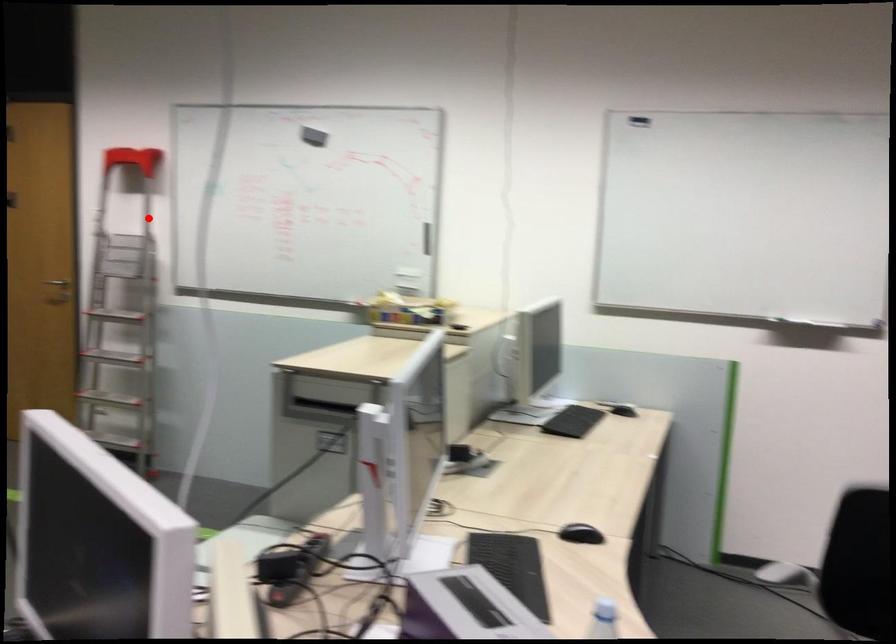
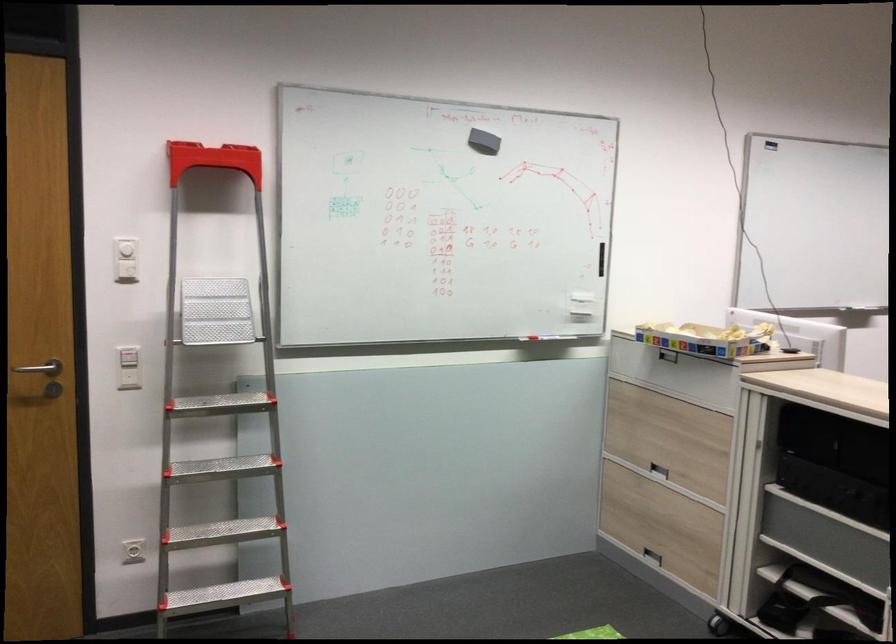
Question: I am providing you with two images of the same scene from different viewpoints. A red point is marked on the first image. Is the red point's position out of view in image 2?

Choices:
 (A) Yes
 (B) No

Answer: (B)